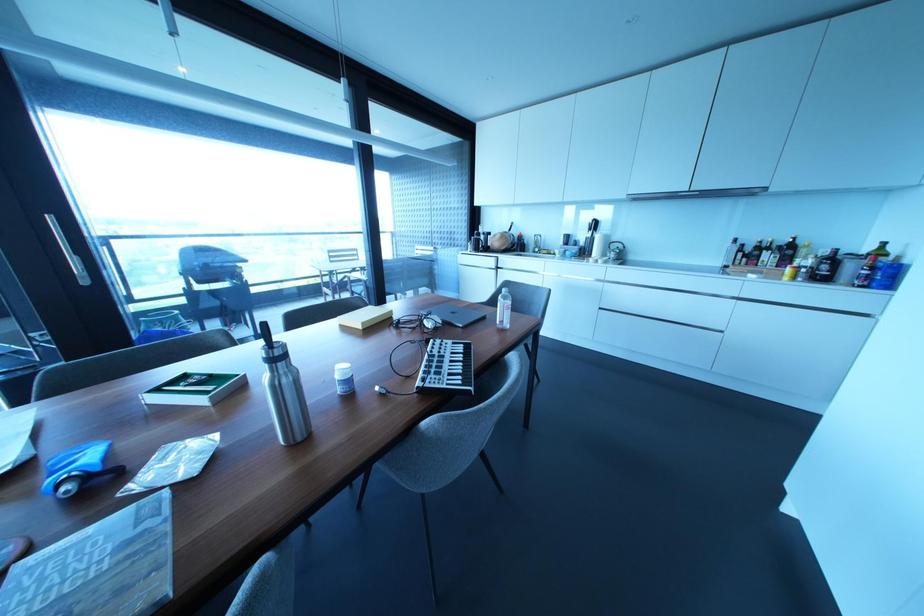
The image size is (924, 616). Find the location of `grill lid handle`. grill lid handle is located at coordinates pyautogui.click(x=77, y=469).